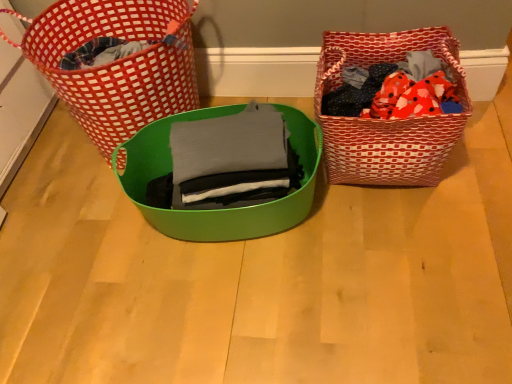
Locate an element on the screen. This screenshot has width=512, height=384. vacant space in front of green plastic bowl at center is located at coordinates (251, 313).